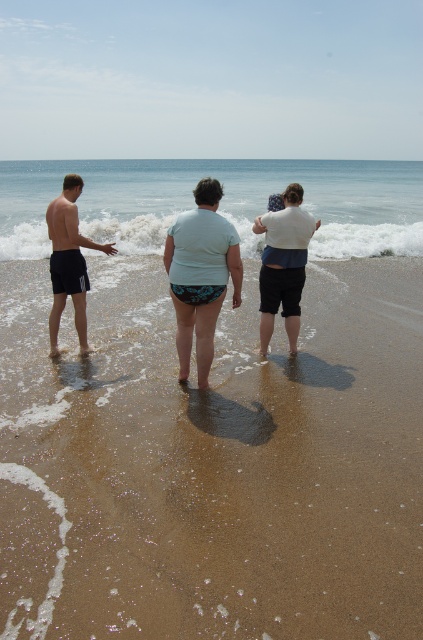
Question: Which of the following is the closest to the observer?

Choices:
 (A) (203, 340)
 (B) (283, 273)

Answer: (A)

Question: Among these points, which one is farthest from the camera?

Choices:
 (A) (69, 216)
 (B) (200, 300)
 (C) (275, 252)

Answer: (C)

Question: Can you confirm if brown sandy beach at center is thinner than matte black shorts at left?

Choices:
 (A) yes
 (B) no

Answer: (B)

Question: Which object is the closest to the matte black shorts at left?

Choices:
 (A) brown sandy beach at center
 (B) clear blue water at center
 (C) blue printed swimsuit at center

Answer: (C)

Question: Can you confirm if white cotton shirt at center is wider than matte black shorts at left?

Choices:
 (A) no
 (B) yes

Answer: (A)

Question: Is white cotton shirt at center smaller than matte black shorts at left?

Choices:
 (A) yes
 (B) no

Answer: (A)